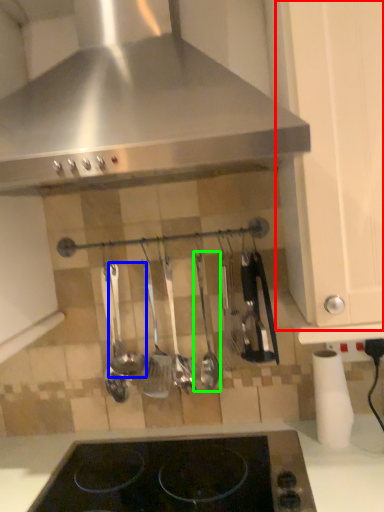
Question: Estimate the real-world distances between objects in this image. Which object is farther from cabinetry (highlighted by a red box), utensil (highlighted by a blue box) or silverware (highlighted by a green box)?

Choices:
 (A) utensil
 (B) silverware

Answer: (A)